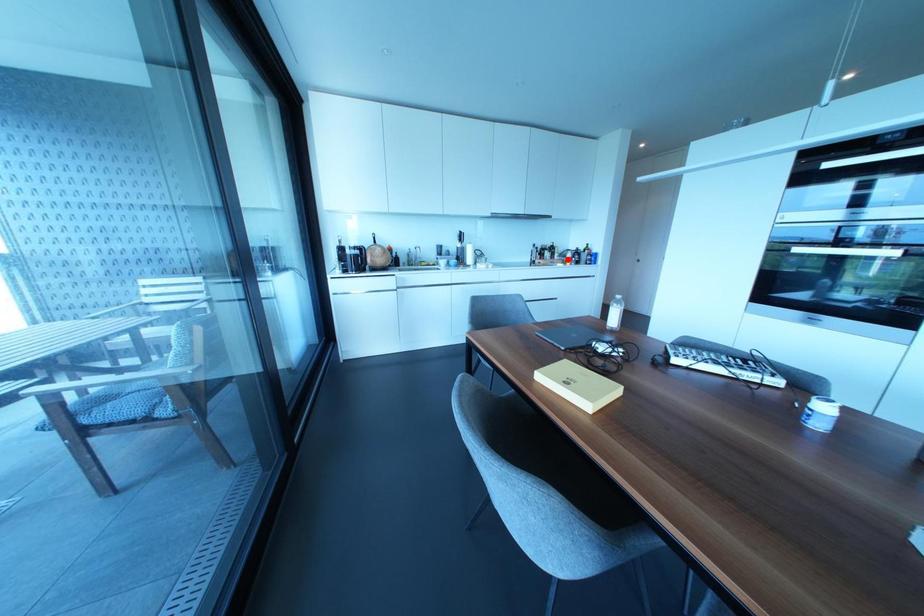
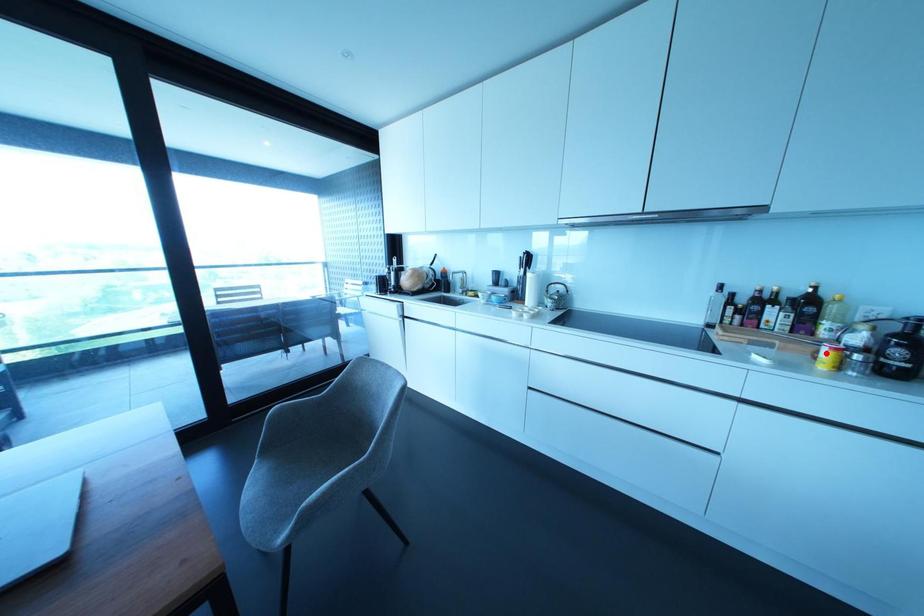
I am providing you with two images of the same scene from different viewpoints. A red point is marked on the first image and another point is marked on the second image. Do the highlighted points in image1 and image2 indicate the same real-world spot?

Yes